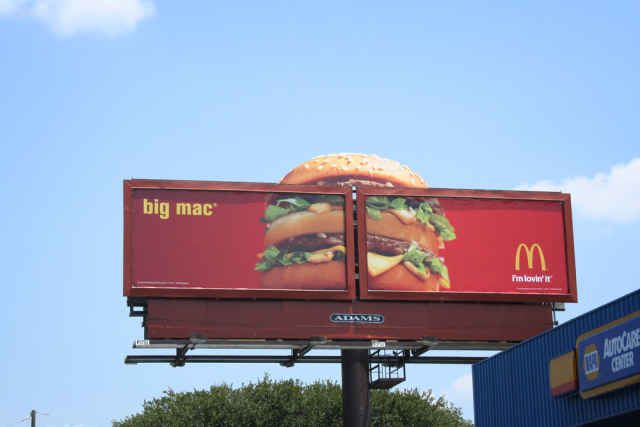
You are a GUI agent. You are given a task and a screenshot of the screen. Output one action in this format:
    pyautogui.click(x=<x>, y=<y>)
    Task: Click on the frame
    The height and width of the screenshot is (427, 640).
    Given the screenshot: What is the action you would take?
    (x=476, y=281)